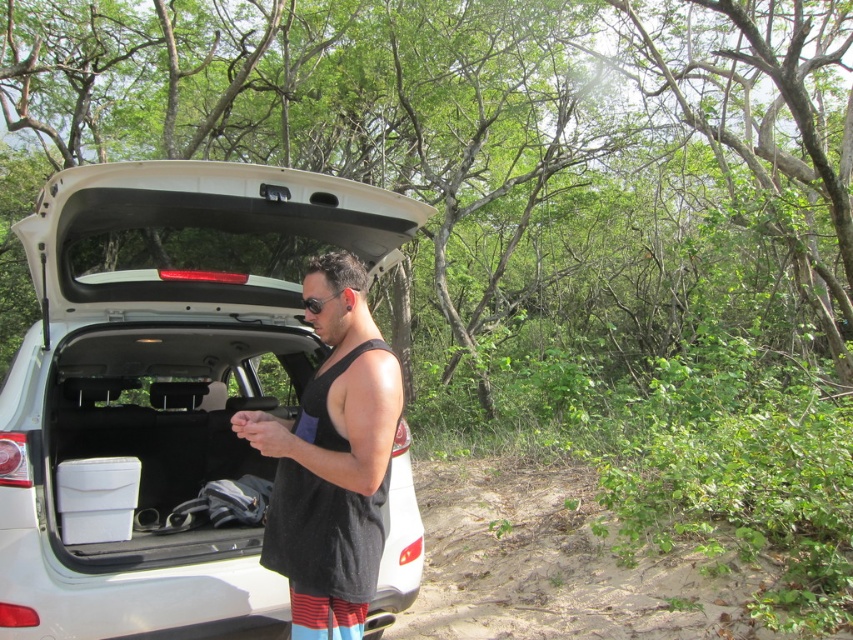
You are a delivery person who needs to place a large package in the trunk. Considering the white matte car trunk at center and the black mesh tank top at center, which object is taller and can accommodate the package?

The white matte car trunk at center is taller than the black mesh tank top at center, so it can accommodate the package.

You are a photographer taking a picture of the white matte car trunk at center and the black mesh tank top at center. To ensure both are in frame, should you adjust your camera to focus more to the left or the right?

The white matte car trunk at center is positioned on the left side of black mesh tank top at center, so you should focus more to the left to include both in the frame.

You are trying to determine the spatial relationship between the white matte car trunk at center and the black mesh tank top at center in the image. Based on their positions, which object is located higher from the ground?

The black mesh tank top at center is higher from the ground than the white matte car trunk at center because the white matte car trunk at center is positioned below it.